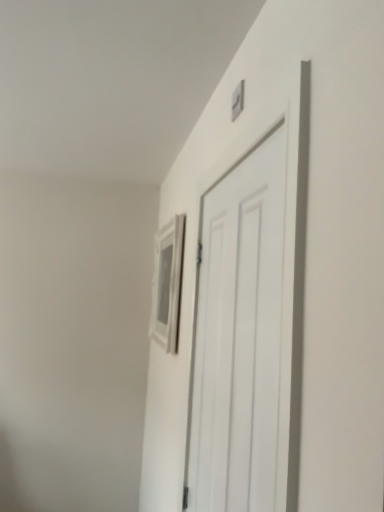
The width and height of the screenshot is (384, 512). Describe the element at coordinates (238, 337) in the screenshot. I see `white matte door at center` at that location.

You are a GUI agent. You are given a task and a screenshot of the screen. Output one action in this format:
    pyautogui.click(x=<x>, y=<y>)
    Task: Click on the white matte door at center
    This screenshot has height=512, width=384.
    Given the screenshot: What is the action you would take?
    coord(238,337)

The height and width of the screenshot is (512, 384). What do you see at coordinates (167, 283) in the screenshot?
I see `matte silver picture frame at upper center` at bounding box center [167, 283].

Image resolution: width=384 pixels, height=512 pixels. I want to click on matte silver picture frame at upper center, so 167,283.

Locate an element on the screen. white matte door at center is located at coordinates (238, 337).

Considering the relative positions of matte silver picture frame at upper center and white matte door at center in the image provided, is matte silver picture frame at upper center to the left or to the right of white matte door at center?

matte silver picture frame at upper center is to the left of white matte door at center.

Is matte silver picture frame at upper center in front of or behind white matte door at center in the image?

Visually, matte silver picture frame at upper center is located behind white matte door at center.

Is point (153, 283) farther from camera compared to point (280, 245)?

Yes, it is behind point (280, 245).

From the picture: From the image's perspective, which is below, matte silver picture frame at upper center or white matte door at center?

white matte door at center, from the image's perspective.

From a real-world perspective, is matte silver picture frame at upper center physically located above or below white matte door at center?

In terms of real-world spatial position, matte silver picture frame at upper center is above white matte door at center.

Is matte silver picture frame at upper center wider or thinner than white matte door at center?

Considering their sizes, matte silver picture frame at upper center looks broader than white matte door at center.

Between matte silver picture frame at upper center and white matte door at center, which one has less height?

Standing shorter between the two is matte silver picture frame at upper center.

Is matte silver picture frame at upper center bigger than white matte door at center?

No.

Consider the image. Is matte silver picture frame at upper center not inside white matte door at center?

Yes, matte silver picture frame at upper center is not within white matte door at center.

Is matte silver picture frame at upper center positioned far away from white matte door at center?

No.

Is matte silver picture frame at upper center oriented away from white matte door at center?

matte silver picture frame at upper center is not turned away from white matte door at center.

Identify the location of picture frame that appears behind the white matte door at center. The width and height of the screenshot is (384, 512). (167, 283).

Considering the positions of objects white matte door at center and matte silver picture frame at upper center in the image provided, who is more to the left, white matte door at center or matte silver picture frame at upper center?

From the viewer's perspective, matte silver picture frame at upper center appears more on the left side.

Which object is further away from the camera taking this photo, white matte door at center or matte silver picture frame at upper center?

matte silver picture frame at upper center is further from the camera.

Does point (262, 267) come farther from viewer compared to point (157, 241)?

No, it is in front of (157, 241).

From the image's perspective, relative to matte silver picture frame at upper center, is white matte door at center above or below?

From the image's perspective, white matte door at center appears below matte silver picture frame at upper center.

From a real-world perspective, is white matte door at center above or below matte silver picture frame at upper center?

white matte door at center is below matte silver picture frame at upper center.

In the scene shown: Considering the sizes of objects white matte door at center and matte silver picture frame at upper center in the image provided, who is wider, white matte door at center or matte silver picture frame at upper center?

With larger width is matte silver picture frame at upper center.

In terms of height, does white matte door at center look taller or shorter compared to matte silver picture frame at upper center?

Clearly, white matte door at center is taller compared to matte silver picture frame at upper center.

In terms of size, does white matte door at center appear bigger or smaller than matte silver picture frame at upper center?

white matte door at center is bigger than matte silver picture frame at upper center.

Is matte silver picture frame at upper center located within white matte door at center?

No, white matte door at center does not contain matte silver picture frame at upper center.

Is the surface of white matte door at center in direct contact with matte silver picture frame at upper center?

There is a gap between white matte door at center and matte silver picture frame at upper center.

Is white matte door at center oriented towards matte silver picture frame at upper center?

No, white matte door at center does not turn towards matte silver picture frame at upper center.

How many degrees apart are the facing directions of white matte door at center and matte silver picture frame at upper center?

3.96 degrees separate the facing orientations of white matte door at center and matte silver picture frame at upper center.

The height and width of the screenshot is (512, 384). Identify the location of door below the matte silver picture frame at upper center (from the image's perspective). (238, 337).

Identify the location of door that appears in front of the matte silver picture frame at upper center. The height and width of the screenshot is (512, 384). (238, 337).

Identify the location of picture frame positioned vertically above the white matte door at center (from a real-world perspective). (167, 283).